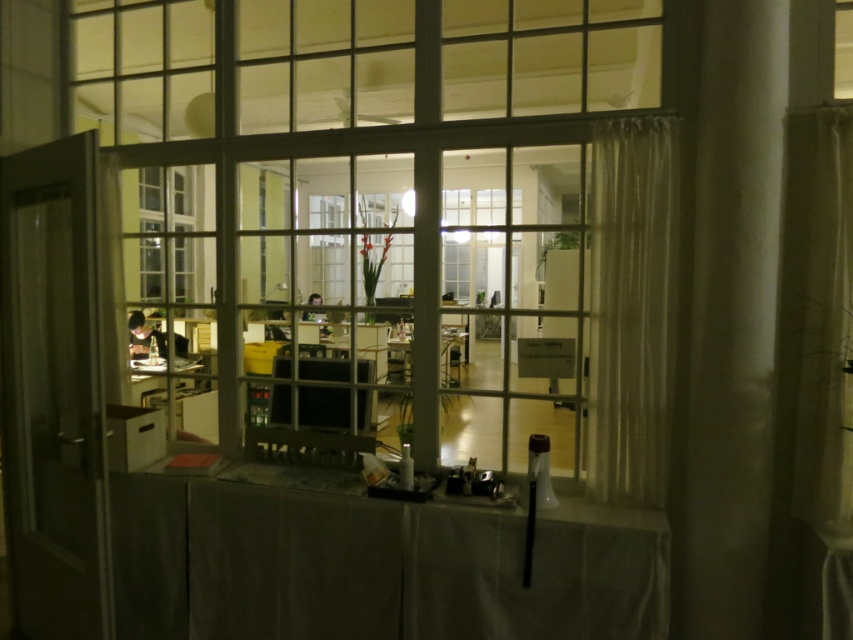
Question: Is white sheer curtain at right thinner than matte wooden table at center?

Choices:
 (A) no
 (B) yes

Answer: (B)

Question: Which object is positioned farthest from the clear glass window at center?

Choices:
 (A) sheer white curtain at right
 (B) smooth gray table at center
 (C) transparent glass door at left

Answer: (A)

Question: Observing the image, what is the correct spatial positioning of sheer white curtain at right in reference to matte wooden table at center?

Choices:
 (A) below
 (B) above

Answer: (B)

Question: Among these objects, which one is nearest to the camera?

Choices:
 (A) clear glass window at center
 (B) white sheer curtain at right

Answer: (B)

Question: Which object is closer to the camera taking this photo?

Choices:
 (A) sheer white curtain at right
 (B) smooth gray table at center
 (C) white sheer curtain at right
 (D) clear glass window at center

Answer: (C)

Question: Observing the image, what is the correct spatial positioning of smooth gray table at center in reference to transparent glass door at left?

Choices:
 (A) above
 (B) below

Answer: (B)